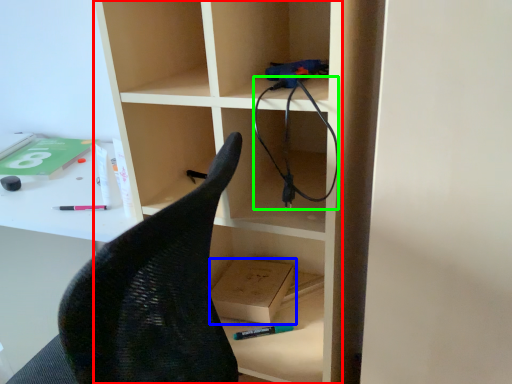
Question: Considering the real-world distances, which object is farthest from bookshelf (highlighted by a red box)? cardboard box (highlighted by a blue box) or cable (highlighted by a green box)?

Choices:
 (A) cardboard box
 (B) cable

Answer: (A)